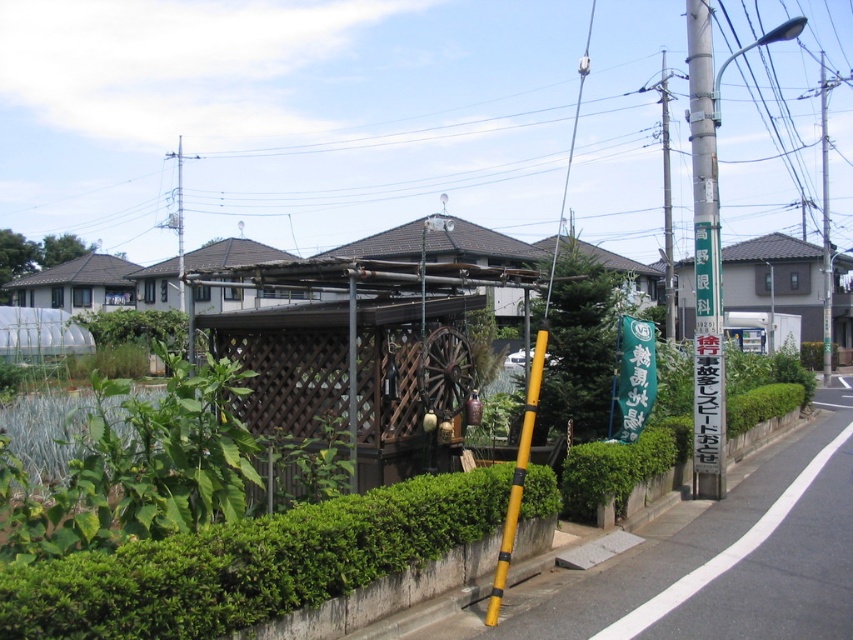
Question: From the image, what is the correct spatial relationship of green leafy hedge at lower left in relation to metallic gray pole at center-right?

Choices:
 (A) above
 (B) below

Answer: (B)

Question: Which of the following is the closest to the observer?

Choices:
 (A) (186, 328)
 (B) (669, 321)

Answer: (B)

Question: Among these objects, which one is nearest to the camera?

Choices:
 (A) green painted metal signpost at right side
 (B) smooth gray pole at right
 (C) metallic gray pole at center-right
 (D) green leafy hedge at left

Answer: (D)

Question: Can you confirm if green leafy hedge at lower left is positioned to the left of green leafy hedge at left?

Choices:
 (A) no
 (B) yes

Answer: (A)

Question: Among these objects, which one is nearest to the camera?

Choices:
 (A) green painted metal signpost at right side
 (B) green leafy hedge at left
 (C) green leafy hedge at lower center

Answer: (B)

Question: Can you confirm if green leafy hedge at lower left is positioned below green painted metal signpost at right side?

Choices:
 (A) yes
 (B) no

Answer: (A)